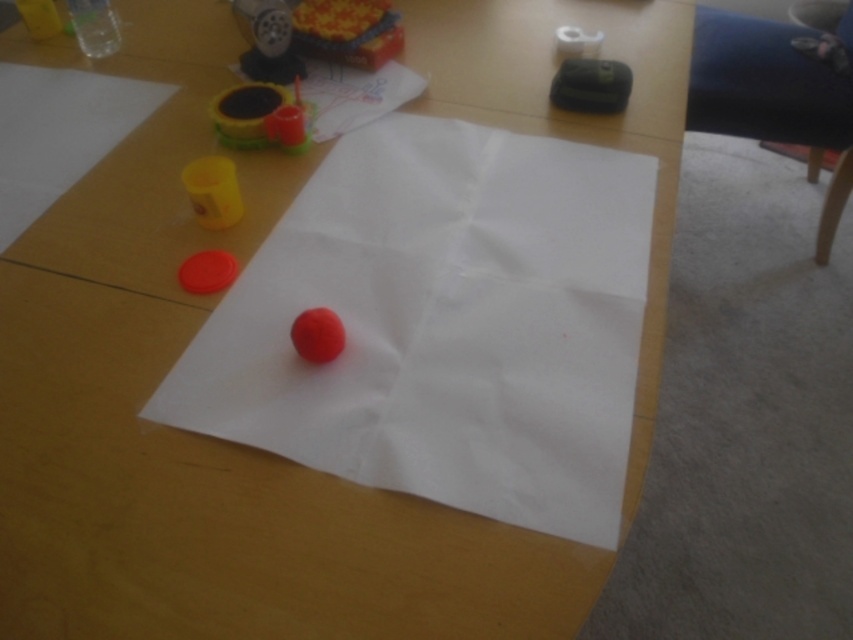
You are standing at the edge of the wooden table looking towards the center. You see the rubberized plastic toy at upper center. Can you estimate its position relative to the center of the table using coordinates?

The rubberized plastic toy at upper center is located at coordinates approximately 0.050 on the x axis and 0.408 on the y axis, so it is positioned slightly to the left and above the center of the table.